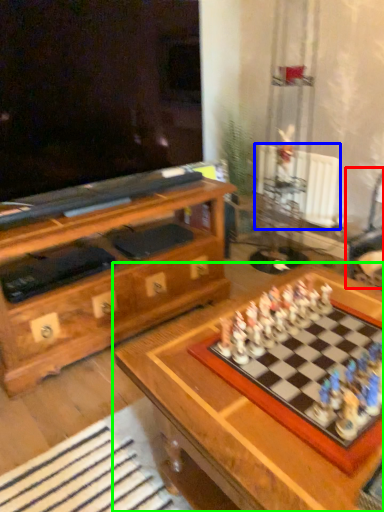
Question: Which object is positioned closest to swivel chair (highlighted by a red box)? Select from radiator (highlighted by a blue box) and table (highlighted by a green box).

Choices:
 (A) radiator
 (B) table

Answer: (A)